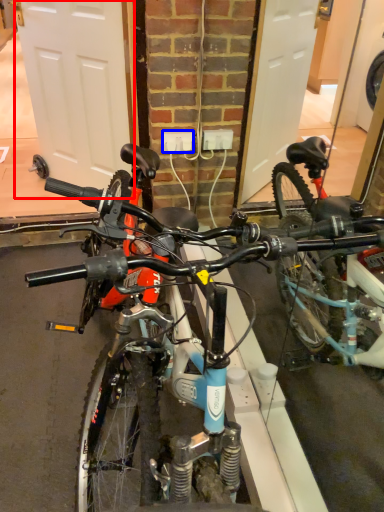
Question: Which object is closer to the camera taking this photo, garage door (highlighted by a red box) or power outlet (highlighted by a blue box)?

Choices:
 (A) garage door
 (B) power outlet

Answer: (A)